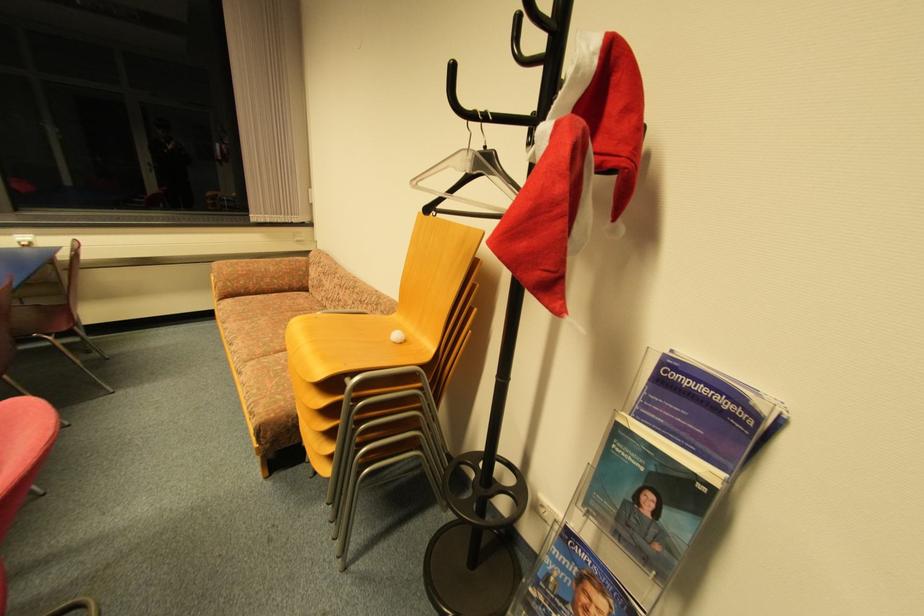
The image size is (924, 616). Find the location of `sofa armrest`. sofa armrest is located at coordinates (259, 276).